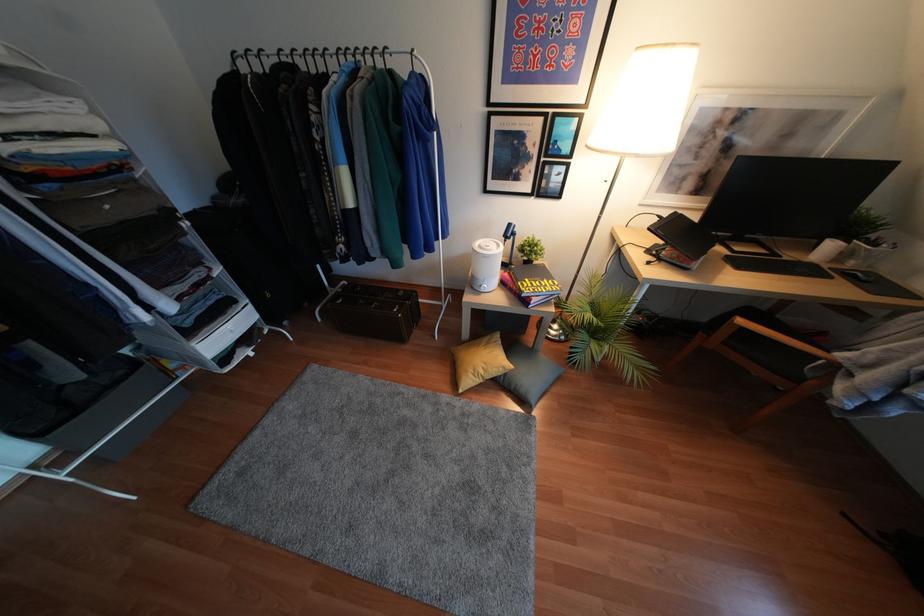
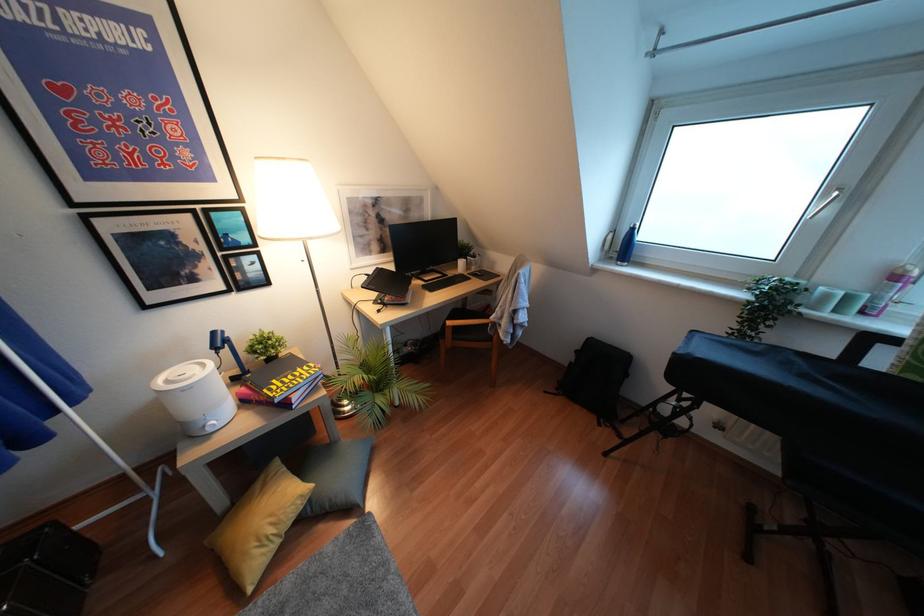
Find the pixel in the second image that matches point 480,371 in the first image.

(271, 530)